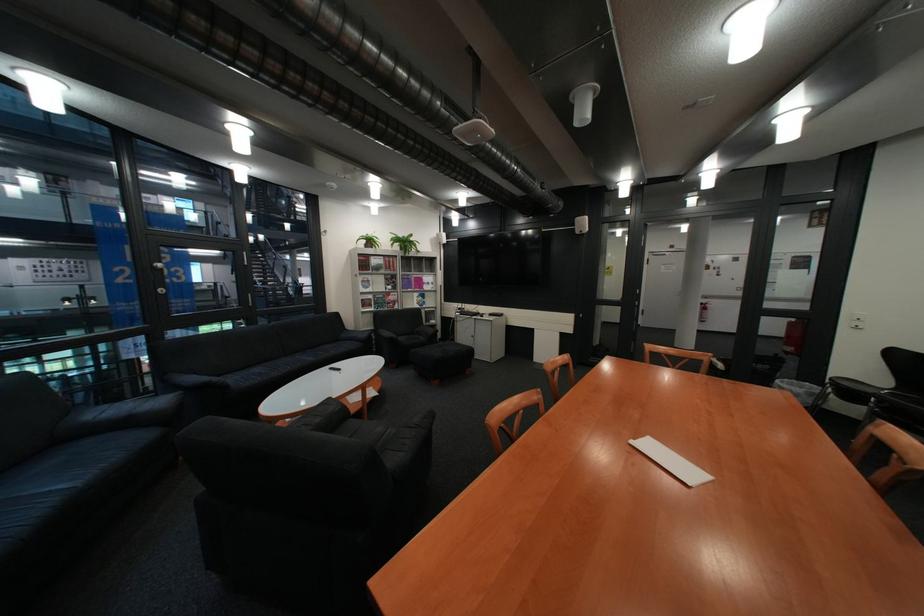
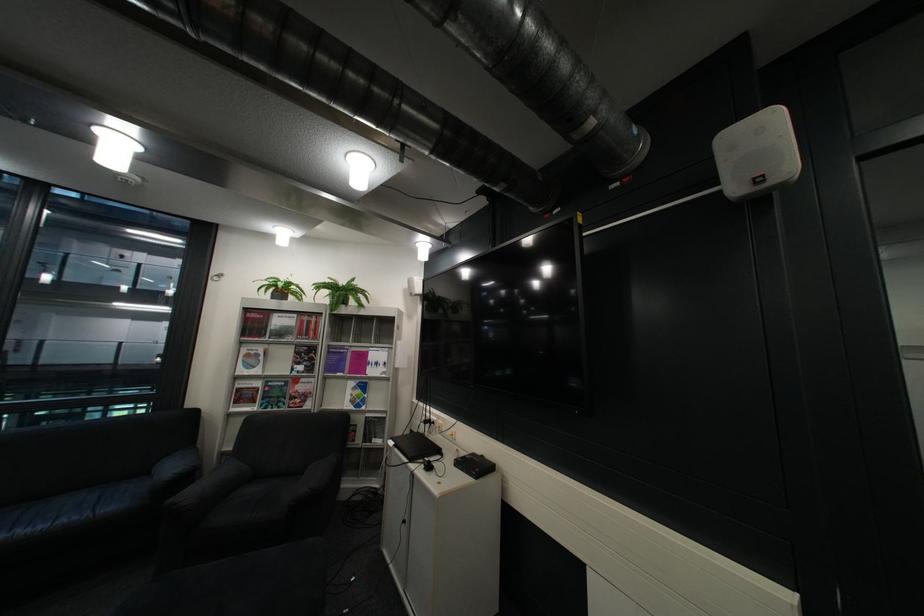
What movement of the cameraman would produce the second image?

The movement direction of the cameraman is right, forward.